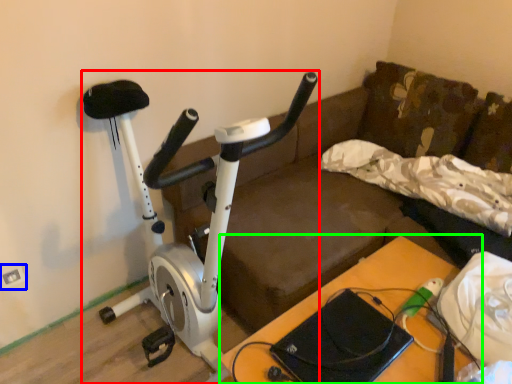
Question: Considering the real-world distances, which object is closest to stationary bicycle (highlighted by a red box)? electric outlet (highlighted by a blue box) or table (highlighted by a green box).

Choices:
 (A) electric outlet
 (B) table

Answer: (B)